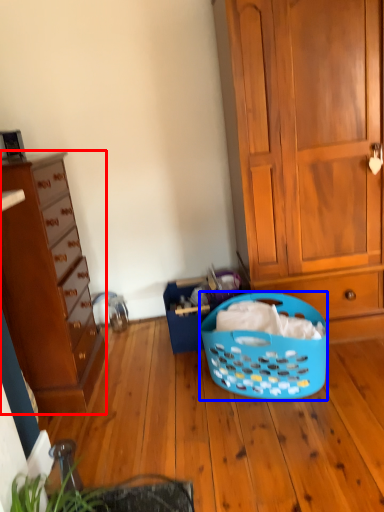
Question: Which point is further to the camera, cabinetry (highlighted by a red box) or picnic basket (highlighted by a blue box)?

Choices:
 (A) cabinetry
 (B) picnic basket

Answer: (B)